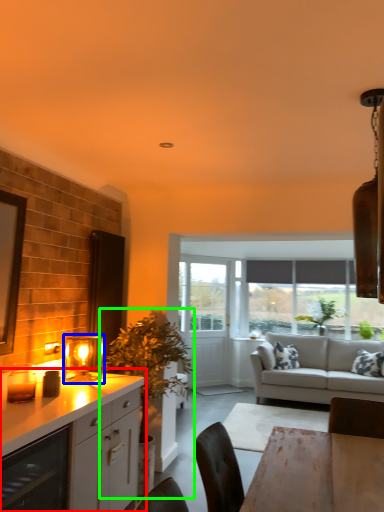
Question: Which object is positioned farthest from cabinetry (highlighted by a red box)? Select from light fixture (highlighted by a blue box) and houseplant (highlighted by a green box).

Choices:
 (A) light fixture
 (B) houseplant

Answer: (B)